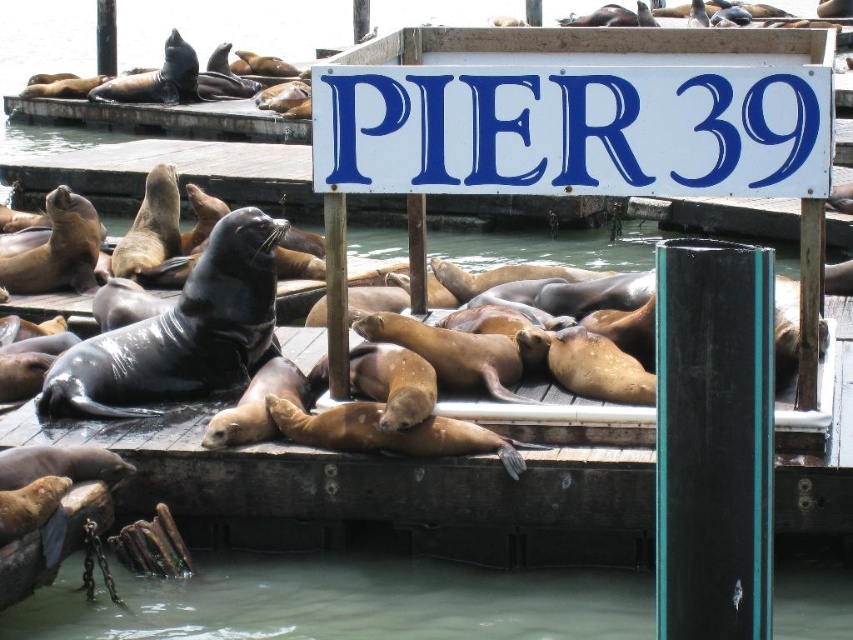
Question: Among these points, which one is nearest to the camera?

Choices:
 (A) click(666, 154)
 (B) click(413, 621)

Answer: (A)

Question: Can you confirm if white painted wood sign at center is positioned to the right of greenish murky water at lower center?

Choices:
 (A) no
 (B) yes

Answer: (B)

Question: Does white painted wood sign at center have a lesser width compared to greenish murky water at lower center?

Choices:
 (A) no
 (B) yes

Answer: (B)

Question: From the image, what is the correct spatial relationship of white painted wood sign at center in relation to greenish murky water at lower center?

Choices:
 (A) above
 (B) below

Answer: (A)